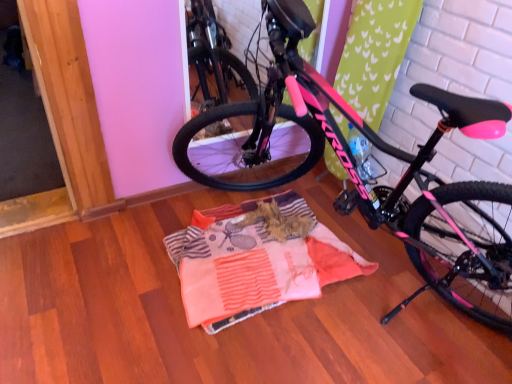
At what (x,y) coordinates should I click in order to perform the action: click on vacant space underneath pink matte bicycle at center (from a real-world perspective). Please return your answer as a coordinate pair (x, y). This screenshot has width=512, height=384. Looking at the image, I should click on (378, 309).